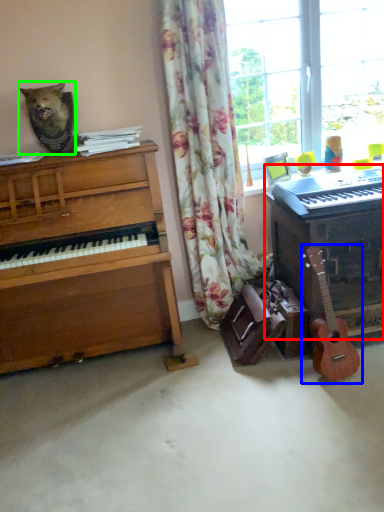
Question: Estimate the real-world distances between objects in this image. Which object is farther from piano (highlighted by a red box), guitar (highlighted by a blue box) or animal (highlighted by a green box)?

Choices:
 (A) guitar
 (B) animal

Answer: (B)